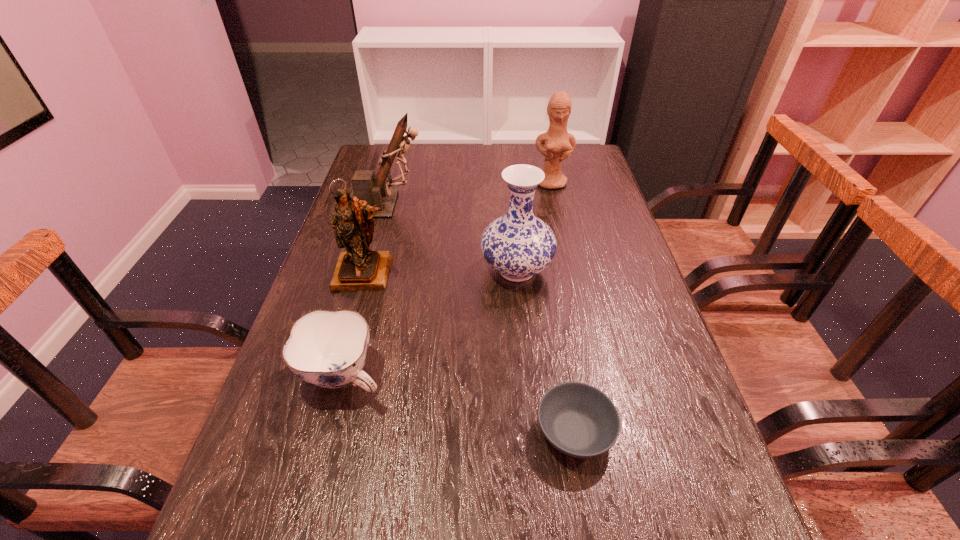
This screenshot has width=960, height=540. What are the coordinates of `vacant area that lies between the shortest object and the chinaware` in the screenshot? It's located at 459,403.

This screenshot has height=540, width=960. I want to click on vacant area that lies between the shortest object and the rightmost figurine, so click(x=563, y=307).

Locate an element on the screen. free area in between the vase and the shortest object is located at coordinates (545, 351).

Locate an element on the screen. blank region between the rightmost figurine and the second shortest object is located at coordinates (447, 279).

Locate an element on the screen. Image resolution: width=960 pixels, height=540 pixels. empty space between the nearest figurine and the vase is located at coordinates (441, 272).

Find the location of a particular element. the third closest object to the chinaware is located at coordinates pos(579,420).

Locate which object ranks fifth in proximity to the vase. Please provide its 2D coordinates. Your answer should be formatted as a tuple, i.e. [(x, y)], where the tuple contains the x and y coordinates of a point satisfying the conditions above.

[(559, 144)]

The width and height of the screenshot is (960, 540). In order to click on the second closest figurine to the rightmost figurine in this screenshot , I will do `click(360, 268)`.

The height and width of the screenshot is (540, 960). In order to click on the third closest figurine to the vase in this screenshot , I will do (x=559, y=144).

The height and width of the screenshot is (540, 960). I want to click on vacant area in the image that satisfies the following two spatial constraints: 1. on the front-facing side of the nearest figurine; 2. on the left side of the chinaware, so click(x=336, y=375).